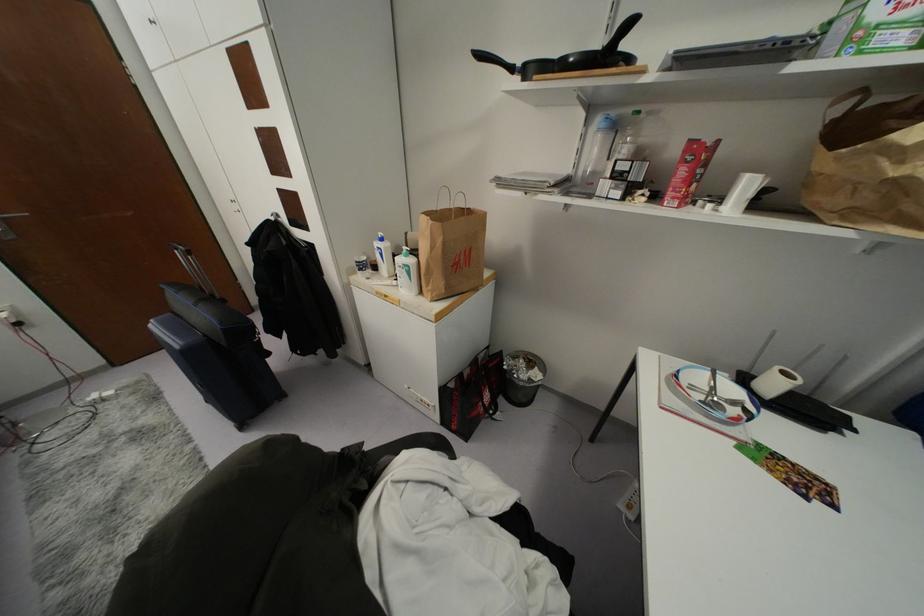
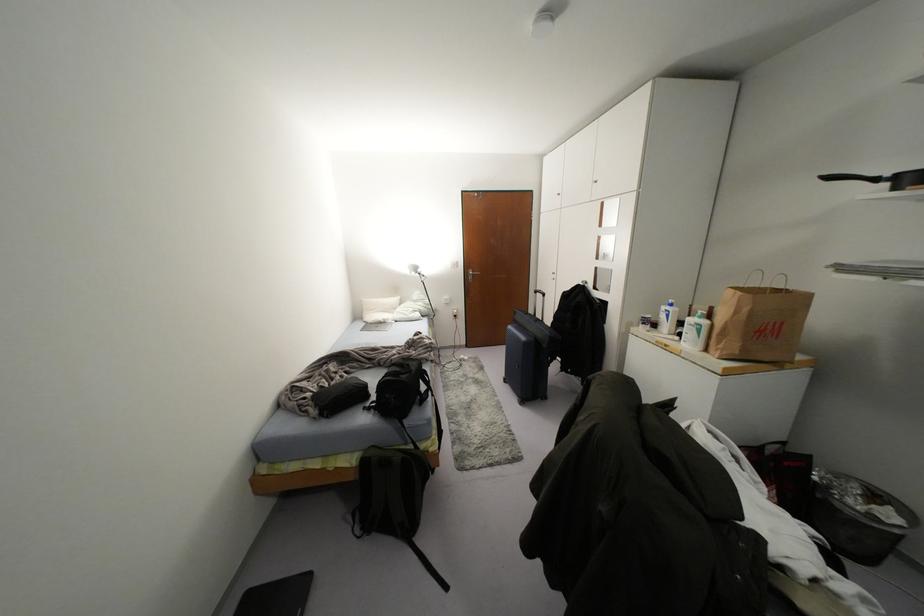
Find the pixel in the second image that matches (x=410, y=261) in the first image.

(703, 322)